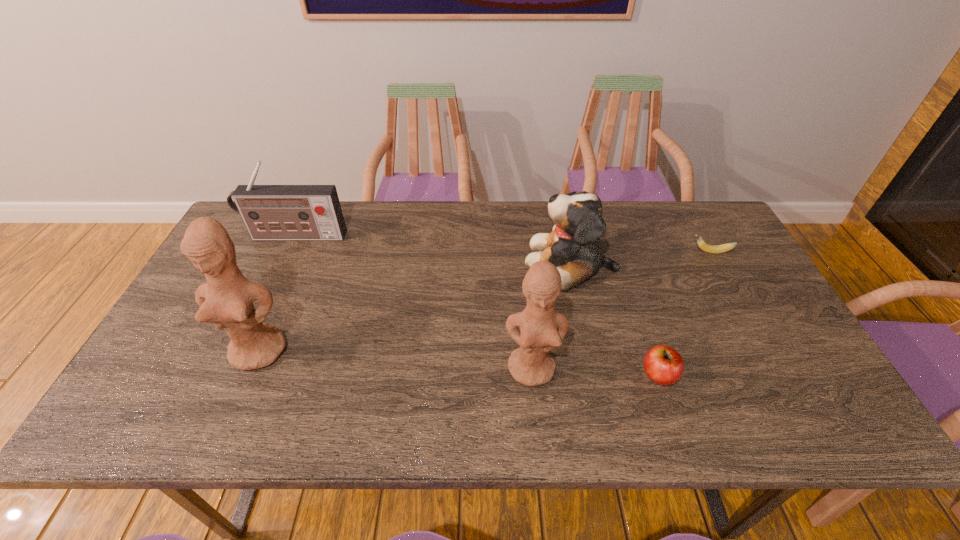
What are the coordinates of `free point that satisfies the following two spatial constraints: 1. at the face of the fourth tallest object; 2. on the front-facing side of the tallest object` in the screenshot? It's located at (588, 350).

The image size is (960, 540). I want to click on blank area in the image that satisfies the following two spatial constraints: 1. at the face of the puppy; 2. on the front-facing side of the tallest object, so click(x=588, y=350).

Find the location of a particular element. This screenshot has width=960, height=540. free space that satisfies the following two spatial constraints: 1. at the face of the third shortest object; 2. on the front-facing side of the shorter figurine is located at coordinates (592, 368).

Identify the location of vacant space that satisfies the following two spatial constraints: 1. at the face of the puppy; 2. on the front-facing side of the left figurine. Image resolution: width=960 pixels, height=540 pixels. (588, 350).